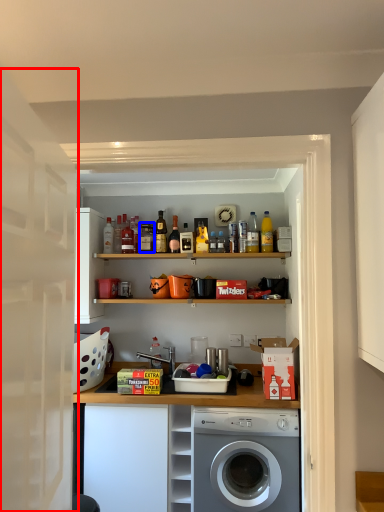
Question: Which of the following is the farthest to the observer, door (highlighted by a red box) or bottle (highlighted by a blue box)?

Choices:
 (A) door
 (B) bottle

Answer: (B)